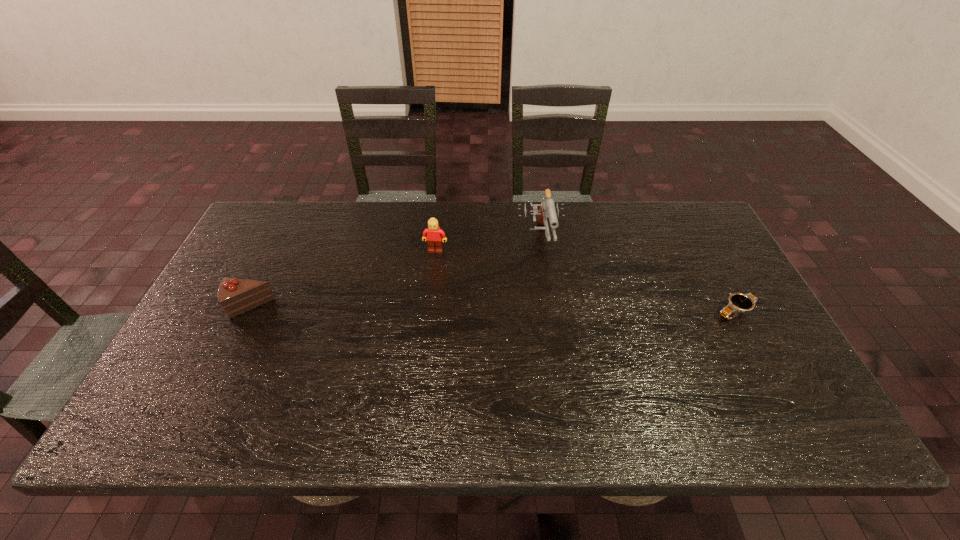
Locate an element on the screen. The height and width of the screenshot is (540, 960). vacant area located on the face of the third object from right to left is located at coordinates (431, 265).

The image size is (960, 540). Identify the location of free space located 0.170m on the face of the third object from right to left. (424, 295).

The image size is (960, 540). In order to click on free space located on the face of the third object from right to left in this screenshot , I will do `click(426, 285)`.

The width and height of the screenshot is (960, 540). I want to click on vacant space situated at the barrel end of the gun, so 547,291.

You are a GUI agent. You are given a task and a screenshot of the screen. Output one action in this format:
    pyautogui.click(x=<x>, y=<y>)
    Task: Click on the vacant point located 0.200m at the barrel end of the gun
    
    Given the screenshot: What is the action you would take?
    pyautogui.click(x=551, y=315)

Identify the location of free space located at the barrel end of the gun. Image resolution: width=960 pixels, height=540 pixels. (556, 350).

Locate an element on the screen. Lego situated at the far edge is located at coordinates (435, 237).

At what (x,y) coordinates should I click in order to perform the action: click on gun that is at the far edge. Please return your answer as a coordinate pair (x, y). Looking at the image, I should click on (547, 208).

I want to click on object that is at the left edge, so click(x=236, y=296).

At what (x,y) coordinates should I click in order to perform the action: click on object that is positioned at the right edge. Please return your answer as a coordinate pair (x, y). Image resolution: width=960 pixels, height=540 pixels. Looking at the image, I should click on (737, 303).